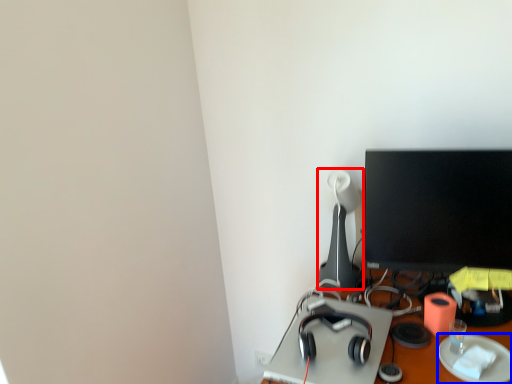
Question: Which point is further to the camera, table lamp (highlighted by a red box) or paper plate (highlighted by a blue box)?

Choices:
 (A) table lamp
 (B) paper plate

Answer: (A)